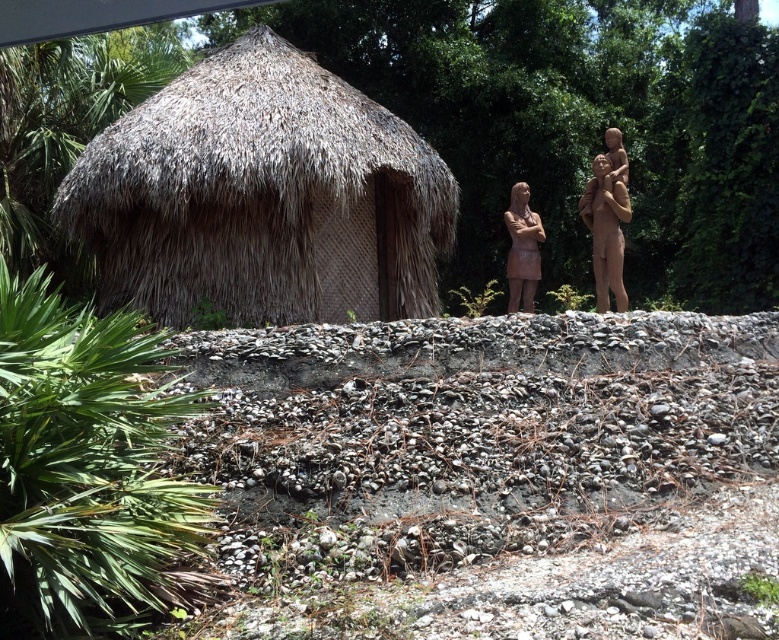
Question: Can you confirm if thatched straw hut at left is smaller than brown matte statue at right?

Choices:
 (A) yes
 (B) no

Answer: (B)

Question: Is thatched straw hut at left further to the viewer compared to matte bronze statue at center?

Choices:
 (A) no
 (B) yes

Answer: (A)

Question: Can you confirm if brown matte statue at right is thinner than matte bronze statue at center?

Choices:
 (A) no
 (B) yes

Answer: (B)

Question: Which of these objects is positioned closest to the thatched straw hut at left?

Choices:
 (A) matte bronze statue at center
 (B) brown matte statue at right

Answer: (A)

Question: Which of these objects is positioned closest to the matte bronze statue at center?

Choices:
 (A) thatched straw hut at left
 (B) brown matte statue at right

Answer: (B)

Question: Which point is closer to the camera?

Choices:
 (A) brown matte statue at right
 (B) thatched straw hut at left
 (C) matte bronze statue at center

Answer: (A)